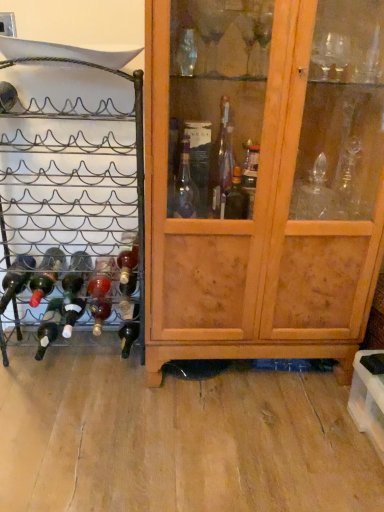
At what (x,y) coordinates should I click in order to perform the action: click on vacant space to the left of matte dark brown bottle at lower left, the second bottle when ordered from left to right. Please return your answer as a coordinate pair (x, y). Image resolution: width=384 pixels, height=512 pixels. Looking at the image, I should click on (22, 349).